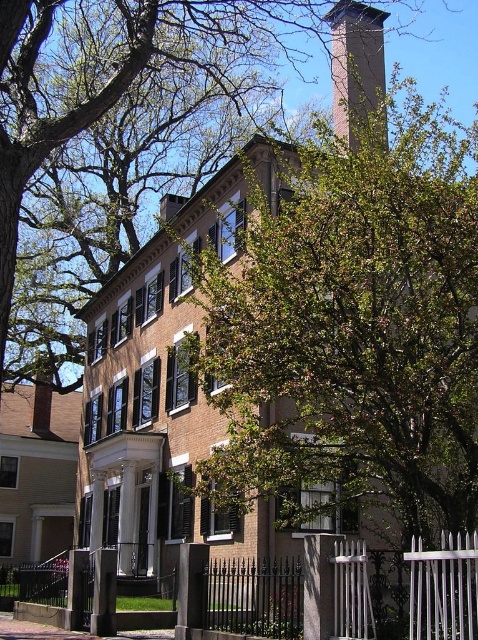
You are a visitor approaching the building and notice the green leafy tree at center and the black wrought iron fence at lower left. Which object appears bigger from your perspective?

The green leafy tree at center appears bigger than the black wrought iron fence at lower left.

You are standing in front of the three story brick building with a covered porch. You want to know where the green leafy tree at upper center is located relative to the building. Can you describe its position using the coordinate system provided in the description?

The green leafy tree at upper center is located at coordinate point 0.194 on the x axis and 0.245 on the y axis relative to the building.

You are a visitor standing in front of the building and want to take a photo that includes both the green leafy tree at center and the black wrought iron fence at lower left. Which object will appear taller in the photo?

The green leafy tree at center will appear taller in the photo because it has a greater height compared to the black wrought iron fence at lower left.